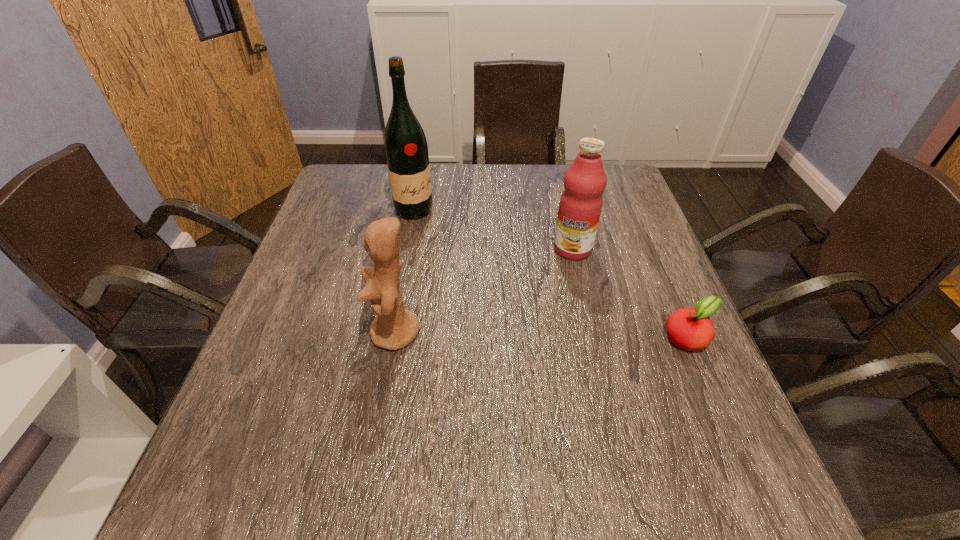
This screenshot has height=540, width=960. In order to click on vacant space situated on the left of the shortest object in this screenshot , I will do `click(526, 338)`.

At what (x,y) coordinates should I click in order to perform the action: click on vacant space located on the front-facing side of the farthest object. Please return your answer as a coordinate pair (x, y). This screenshot has width=960, height=540. Looking at the image, I should click on (476, 264).

Locate an element on the screen. The image size is (960, 540). vacant space situated on the front-facing side of the farthest object is located at coordinates (446, 238).

At what (x,y) coordinates should I click in order to perform the action: click on vacant space located on the front-facing side of the farthest object. Please return your answer as a coordinate pair (x, y). The height and width of the screenshot is (540, 960). Looking at the image, I should click on (449, 240).

At what (x,y) coordinates should I click in order to perform the action: click on vacant space located on the label of the second object from right to left. Please return your answer as a coordinate pair (x, y). Looking at the image, I should click on (539, 314).

Find the location of a particular element. This screenshot has width=960, height=540. vacant space located on the label of the second object from right to left is located at coordinates (546, 299).

Identify the location of vacant point located 0.190m on the label of the second object from right to left. tap(540, 310).

Locate an element on the screen. The width and height of the screenshot is (960, 540). object that is at the far edge is located at coordinates (406, 149).

Image resolution: width=960 pixels, height=540 pixels. Find the location of `object that is at the right edge`. object that is at the right edge is located at coordinates (688, 328).

Where is `blank space at the far edge of the desktop`? This screenshot has width=960, height=540. blank space at the far edge of the desktop is located at coordinates (555, 187).